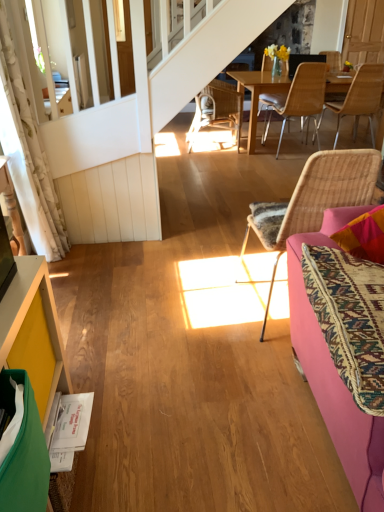
Where is `vacant space behind yellow painted wood cabinet at lower left`? The height and width of the screenshot is (512, 384). vacant space behind yellow painted wood cabinet at lower left is located at coordinates (111, 400).